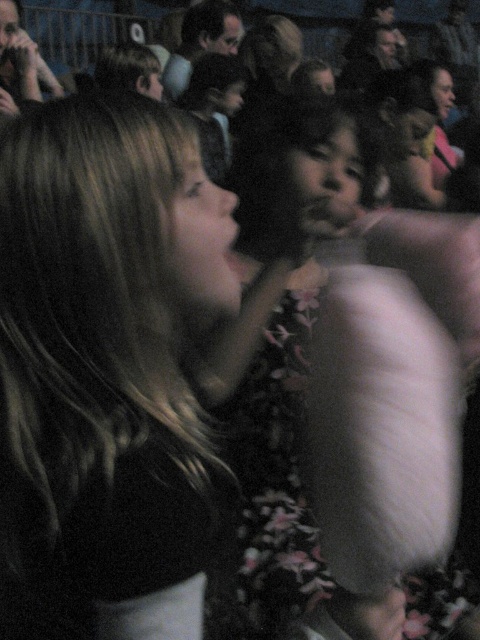
Question: Is dark brown hair at center behind fluffy white dress at center?

Choices:
 (A) no
 (B) yes

Answer: (A)

Question: Among these points, which one is farthest from the camera?

Choices:
 (A) (120, 540)
 (B) (320, 122)

Answer: (B)

Question: Is dark brown hair at center thinner than fluffy white dress at center?

Choices:
 (A) yes
 (B) no

Answer: (A)

Question: Does dark brown hair at center appear on the right side of fluffy white dress at center?

Choices:
 (A) no
 (B) yes

Answer: (A)

Question: Which object is closer to the camera taking this photo?

Choices:
 (A) dark brown hair at center
 (B) fluffy white dress at center

Answer: (A)